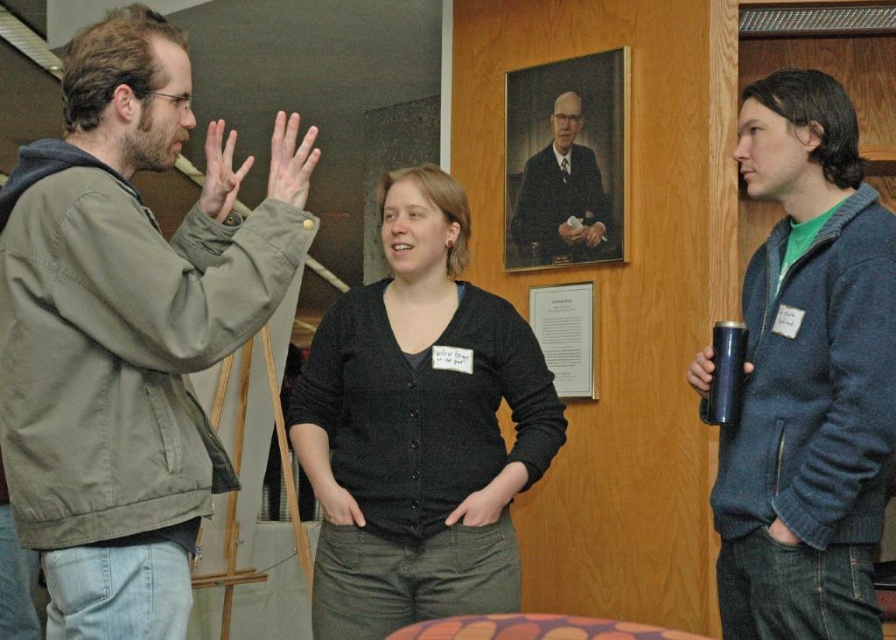
Based on the scene description, which object is larger in size between the dark gray sweater at center and the blue fleece jacket at right?

The dark gray sweater at center is bigger than the blue fleece jacket at right.